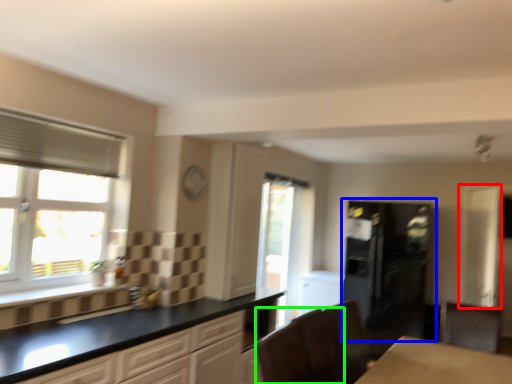
Question: Considering the real-world distances, which object is closest to screen door (highlighted by a red box)? fridge (highlighted by a blue box) or armchair (highlighted by a green box).

Choices:
 (A) fridge
 (B) armchair

Answer: (A)